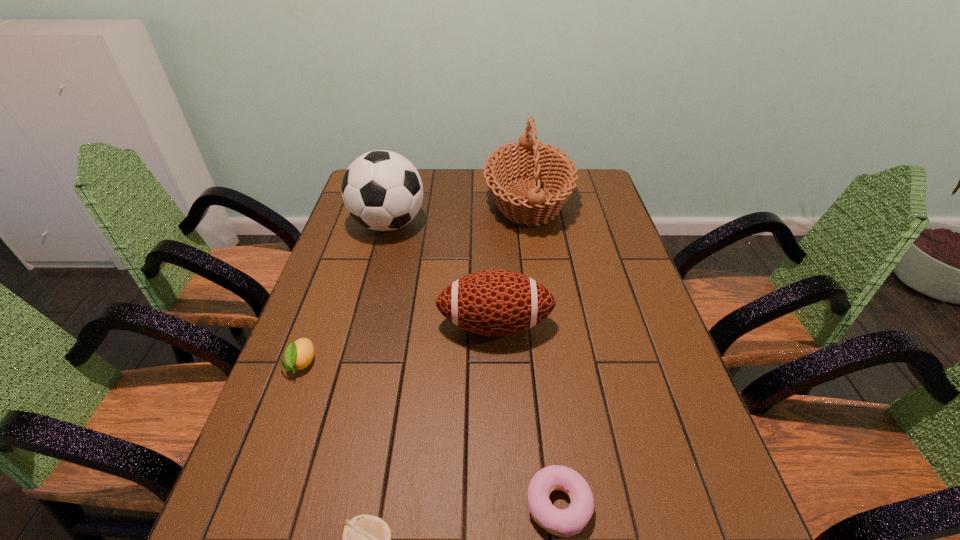
At what (x,y) coordinates should I click in order to perform the action: click on vacant point located between the football and the left lemon. Please return your answer as a coordinate pair (x, y). This screenshot has height=540, width=960. Looking at the image, I should click on (398, 345).

Point out which object is positioned as the fifth nearest to the soccer ball. Please provide its 2D coordinates. Your answer should be formatted as a tuple, i.e. [(x, y)], where the tuple contains the x and y coordinates of a point satisfying the conditions above.

[(366, 539)]

Identify which object is the nearest to the basket. Please provide its 2D coordinates. Your answer should be formatted as a tuple, i.e. [(x, y)], where the tuple contains the x and y coordinates of a point satisfying the conditions above.

[(382, 190)]